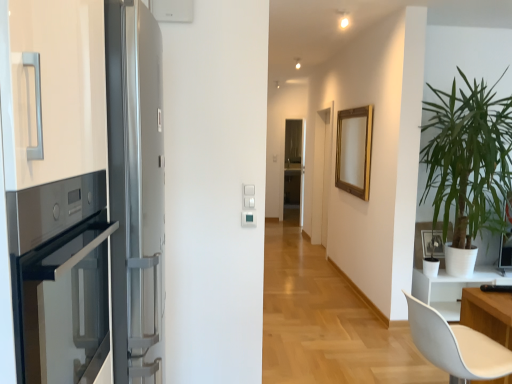
Question: From a real-world perspective, is green leafy plant at right physically located above or below satin silver fridge at left?

Choices:
 (A) below
 (B) above

Answer: (B)

Question: From the image's perspective, relative to satin silver fridge at left, is green leafy plant at right above or below?

Choices:
 (A) below
 (B) above

Answer: (B)

Question: Which of these objects is positioned farthest from the satin black oven at left?

Choices:
 (A) satin silver fridge at left
 (B) white matte picture frame at right, placed as the first picture frame when sorted from bottom to top
 (C) green leafy plant at right
 (D) transparent glass screen door at center
 (E) gold metallic picture frame at upper center, positioned as the second picture frame in front-to-back order

Answer: (D)

Question: Estimate the real-world distances between objects in this image. Which object is farther from the white matte chair at lower right?

Choices:
 (A) gold metallic picture frame at upper center, the first picture frame in the left-to-right sequence
 (B) green leafy plant at right
 (C) transparent glass screen door at center
 (D) satin silver fridge at left
 (E) white matte picture frame at right, placed as the first picture frame when sorted from front to back

Answer: (C)